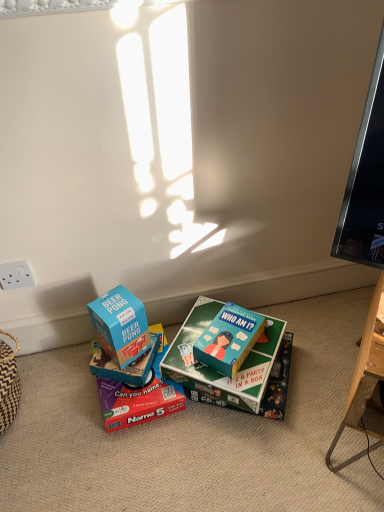
Locate an element on the screen. The width and height of the screenshot is (384, 512). vacant area situated to the left side of matte cardboard box at center, which is counted as the 3th box, starting from the right is located at coordinates (59, 397).